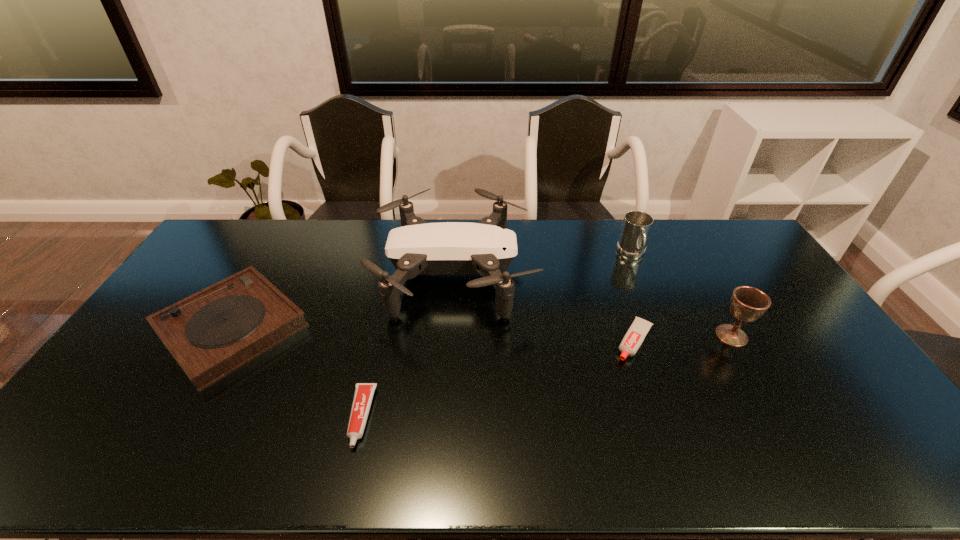
Find the location of a particular element. The width and height of the screenshot is (960, 540). the tallest object is located at coordinates (486, 248).

Identify the location of chalice. (747, 303).

The height and width of the screenshot is (540, 960). Find the location of `mug`. mug is located at coordinates (636, 228).

Where is `the third shortest object`? the third shortest object is located at coordinates (210, 334).

This screenshot has width=960, height=540. Identify the location of the leftmost object. (210, 334).

Locate an element on the screen. the right toothpaste is located at coordinates pos(634,337).

You are a GUI agent. You are given a task and a screenshot of the screen. Output one action in this format:
    pyautogui.click(x=<x>, y=<y>)
    Task: Click on the nearer toothpaste
    The image size is (960, 540).
    Given the screenshot: What is the action you would take?
    pyautogui.click(x=364, y=392)

The image size is (960, 540). What are the coordinates of `vacant space situated on the camera side of the drone` in the screenshot? It's located at [x=614, y=274].

You are a GUI agent. You are given a task and a screenshot of the screen. Output one action in this format:
    pyautogui.click(x=<x>, y=<y>)
    Task: Click on the vacant space located on the back of the chalice
    Image resolution: width=960 pixels, height=540 pixels.
    Given the screenshot: What is the action you would take?
    pyautogui.click(x=686, y=255)

The image size is (960, 540). I want to click on vacant area situated on the side of the mug with the handle, so click(x=643, y=281).